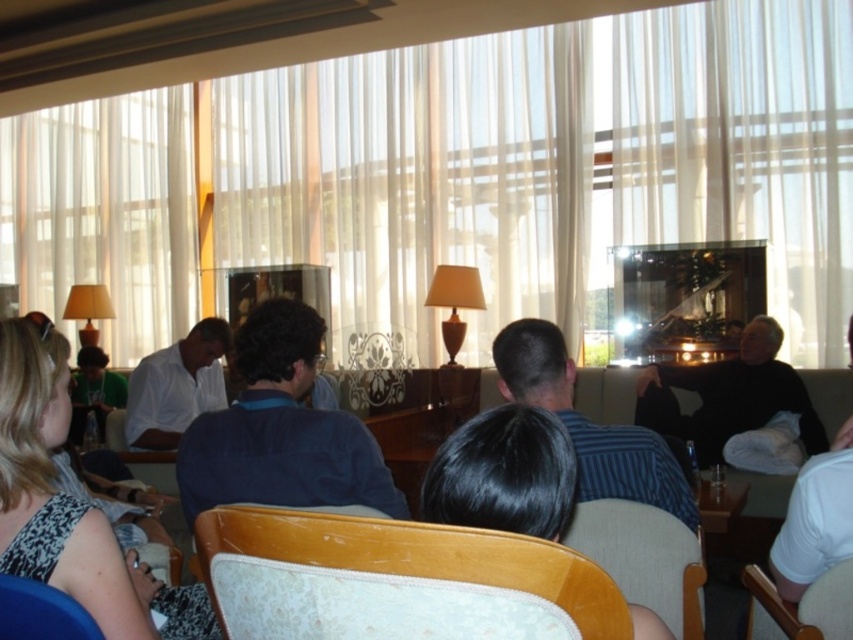
Question: Which is nearer to the wooden chair at center?

Choices:
 (A) blue fabric chair at lower left
 (B) white sheer curtain at upper center
 (C) wooden chair at lower right

Answer: (C)

Question: Which point is farther to the camera?

Choices:
 (A) white matte shirt at center
 (B) black hair at center
 (C) blue denim shirt at center
 (D) worn leather chair at center

Answer: (A)

Question: Is black hair at center to the left of white matte shirt at center from the viewer's perspective?

Choices:
 (A) yes
 (B) no

Answer: (B)

Question: Is black hair at center smaller than wooden chair at lower right?

Choices:
 (A) yes
 (B) no

Answer: (B)

Question: Is the position of wooden chair at center more distant than that of white matte shirt at center?

Choices:
 (A) no
 (B) yes

Answer: (A)

Question: Which of the following is the farthest from the observer?

Choices:
 (A) (206, 376)
 (B) (273, 568)

Answer: (A)